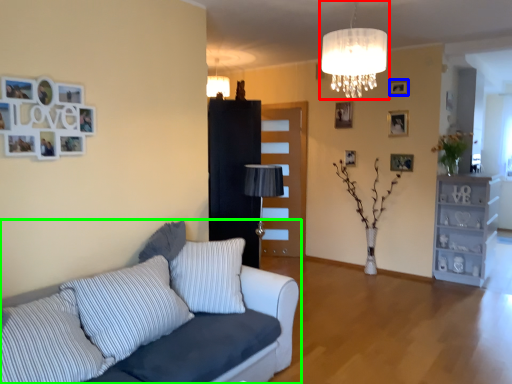
Question: Based on their relative distances, which object is farther from lamp (highlighted by a red box)? Choose from picture frame (highlighted by a blue box) and studio couch (highlighted by a green box).

Choices:
 (A) picture frame
 (B) studio couch

Answer: (A)